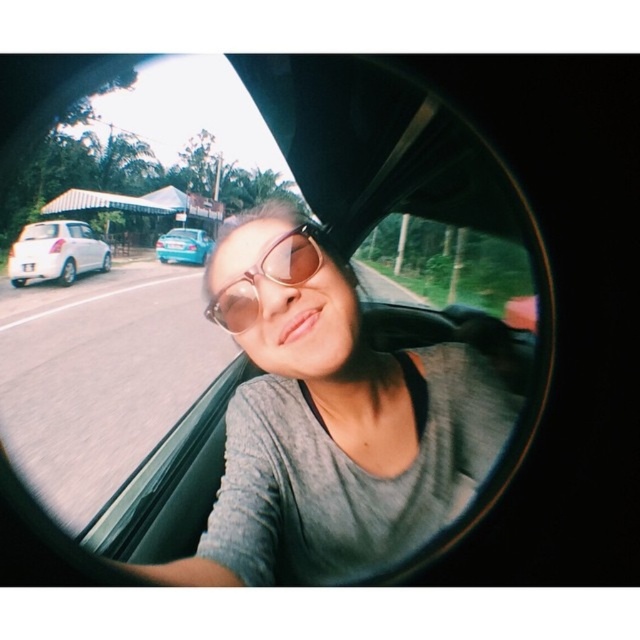
You are a passenger in a car and want to take a selfie using the rearview mirror. You notice the transparent glass car window at center and the matte gray shirt at center. Which object appears taller in the reflection?

The transparent glass car window at center appears taller than the matte gray shirt at center in the reflection.

You are a photographer trying to capture a clear shot of two points marked in the image. The first point is at coordinate point (484, 400) and the second is at point (260, 275). Given that the rearview mirror reflection might distort the perspective, which point is closer to the camera?

Point (484, 400) is further to the camera than point (260, 275), so the second point at point (260, 275) is closer to the camera.

Based on the scene description, where is the white matte hatchback at left located in the image?

The white matte hatchback at left is located at point [54,252] in the image.